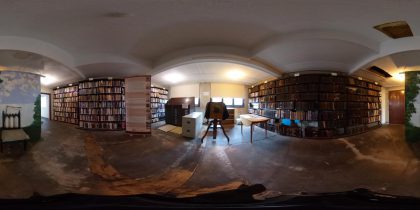
Identify the location of floor. The image size is (420, 210). (185, 161).